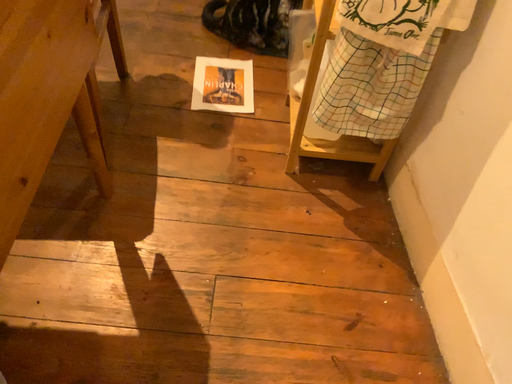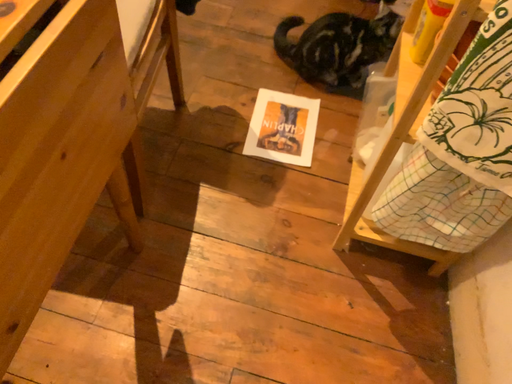
Question: Which way did the camera rotate in the video?

Choices:
 (A) rotated right
 (B) rotated left

Answer: (B)